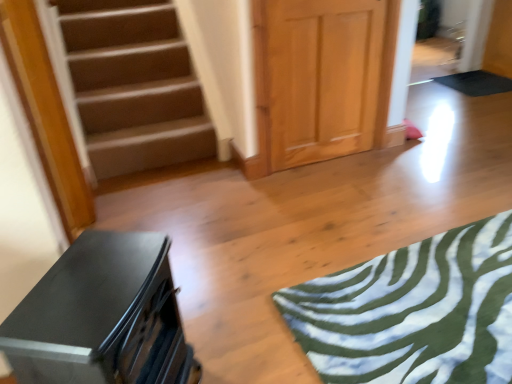
Where is `vacant space to the right of matte black dresser at lower left`? The width and height of the screenshot is (512, 384). vacant space to the right of matte black dresser at lower left is located at coordinates (257, 355).